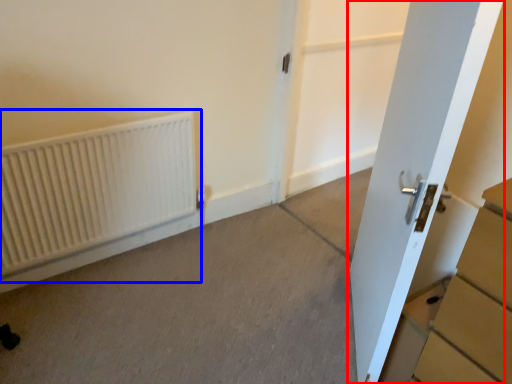
Question: Which of the following is the closest to the observer, door (highlighted by a red box) or radiator (highlighted by a blue box)?

Choices:
 (A) door
 (B) radiator

Answer: (A)